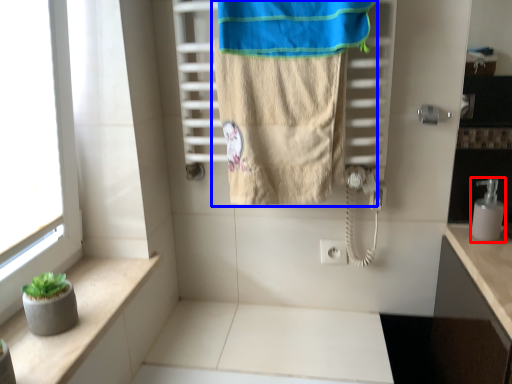
Question: Which point is further to the camera, soap dispenser (highlighted by a red box) or towel (highlighted by a blue box)?

Choices:
 (A) soap dispenser
 (B) towel

Answer: (A)